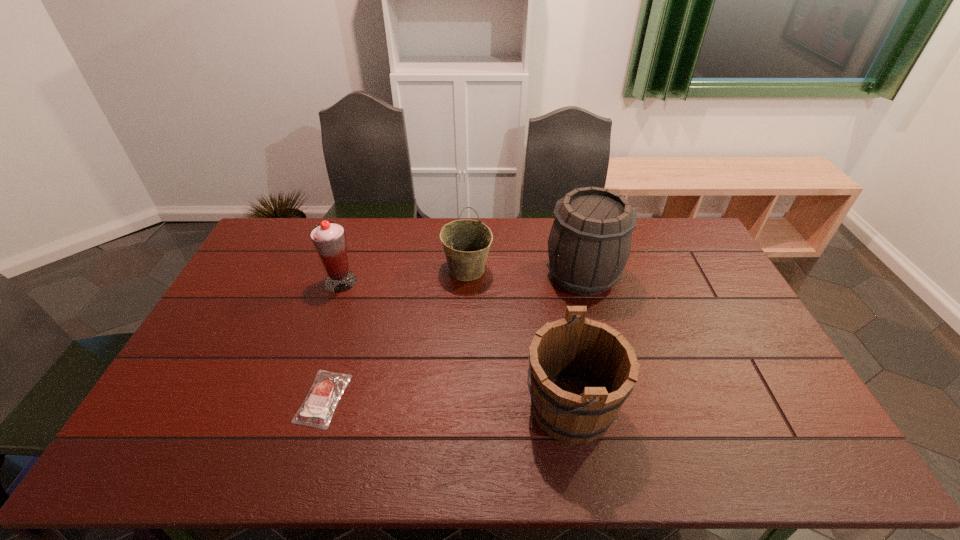
Image resolution: width=960 pixels, height=540 pixels. What are the coordinates of `object situated at the near edge` in the screenshot? It's located at (581, 371).

The width and height of the screenshot is (960, 540). I want to click on vacant space at the far edge, so click(x=531, y=220).

Where is `free location at the near edge of the desktop`? free location at the near edge of the desktop is located at coordinates (755, 463).

Locate an element on the screen. free space at the left edge of the desktop is located at coordinates point(257,321).

In the image, there is a desktop. Where is `vacant space at the right edge`? vacant space at the right edge is located at coordinates (729, 365).

What are the coordinates of `free spot at the far right corner of the desktop` in the screenshot? It's located at (689, 235).

The height and width of the screenshot is (540, 960). Identify the location of empty space that is in between the smoothie and the leftmost wine bucket. (404, 276).

The height and width of the screenshot is (540, 960). Identify the location of free space between the leftmost wine bucket and the nearest wine bucket. (519, 339).

Where is `vacant area between the third object from right to left and the smoothie`? Image resolution: width=960 pixels, height=540 pixels. vacant area between the third object from right to left and the smoothie is located at coordinates (404, 276).

Where is `vacant area that lies between the smoothie and the third object from right to left`? vacant area that lies between the smoothie and the third object from right to left is located at coordinates (404, 276).